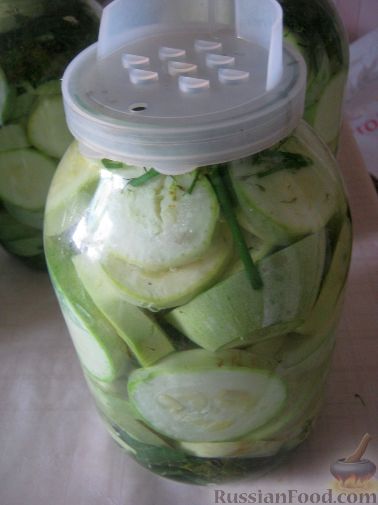
This screenshot has height=505, width=378. I want to click on glass, so click(x=116, y=274), click(x=21, y=118), click(x=320, y=36).